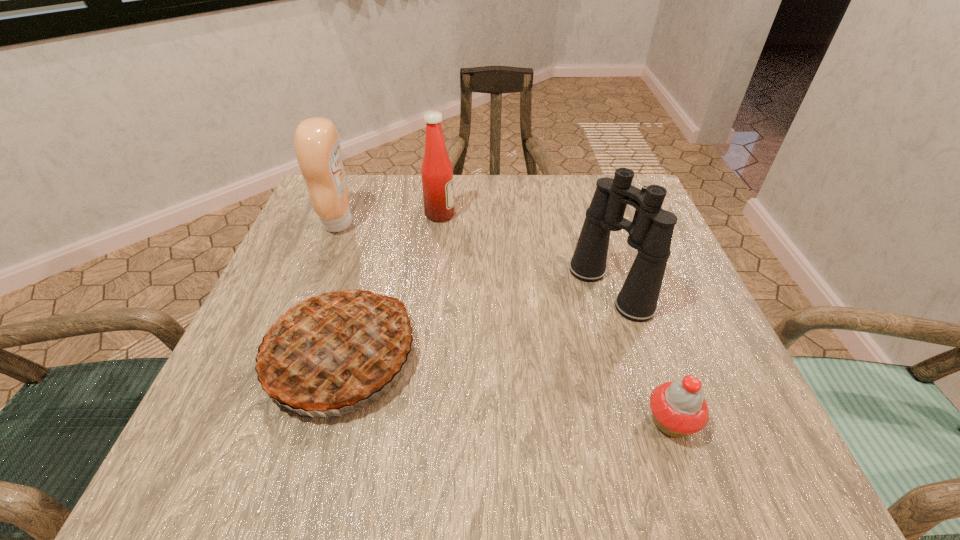
Identify the location of blank space that satisfies the following two spatial constraints: 1. on the front-facing side of the right condiment; 2. on the right side of the binoculars. (432, 288).

This screenshot has height=540, width=960. I want to click on vacant space that satisfies the following two spatial constraints: 1. on the front-facing side of the right condiment; 2. on the right side of the shortest object, so click(x=417, y=422).

You are a GUI agent. You are given a task and a screenshot of the screen. Output one action in this format:
    pyautogui.click(x=<x>, y=<y>)
    Task: Click on the vacant space that satisfies the following two spatial constraints: 1. on the back side of the second shortest object; 2. on the label of the left condiment
    The image size is (960, 540).
    Given the screenshot: What is the action you would take?
    pyautogui.click(x=378, y=223)

What are the coordinates of `free space in the image that satisfies the following two spatial constraints: 1. on the front-facing side of the binoculars; 2. on the left side of the right condiment` in the screenshot? It's located at (432, 288).

Find the location of a particular element. vacant position in the image that satisfies the following two spatial constraints: 1. on the label of the cupcake; 2. on the left side of the left condiment is located at coordinates (260, 422).

This screenshot has height=540, width=960. Identify the location of vacant area in the image that satisfies the following two spatial constraints: 1. on the back side of the binoculars; 2. on the label of the left condiment. (589, 223).

Find the location of a particular element. free spot that satisfies the following two spatial constraints: 1. on the front-facing side of the right condiment; 2. on the back side of the binoculars is located at coordinates (432, 288).